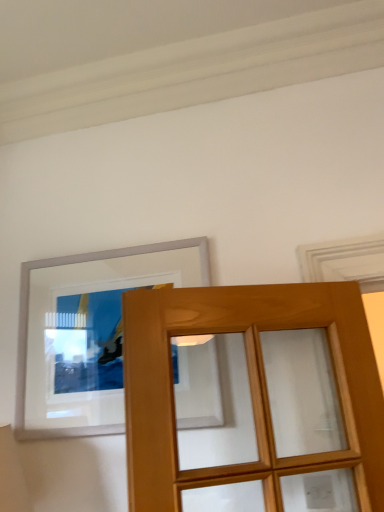
At what (x,y) coordinates should I click in order to perform the action: click on white glossy picture frame at upper left. Please return your answer as a coordinate pair (x, y). Looking at the image, I should click on (87, 333).

Describe the element at coordinates (87, 333) in the screenshot. I see `white glossy picture frame at upper left` at that location.

Measure the distance between point (165, 401) and camera.

The depth of point (165, 401) is 1.16 meters.

The height and width of the screenshot is (512, 384). Describe the element at coordinates (250, 386) in the screenshot. I see `light brown wood door at center` at that location.

What are the coordinates of `light brown wood door at center` in the screenshot? It's located at (250, 386).

Locate an element on the screen. white glossy picture frame at upper left is located at coordinates (87, 333).

Between white glossy picture frame at upper left and light brown wood door at center, which one appears on the left side from the viewer's perspective?

white glossy picture frame at upper left.

Is the position of white glossy picture frame at upper left less distant than that of light brown wood door at center?

No, white glossy picture frame at upper left is further to the viewer.

Does point (27, 368) come in front of point (265, 324)?

No, it is not.

From the image's perspective, is white glossy picture frame at upper left under light brown wood door at center?

No.

From a real-world perspective, does white glossy picture frame at upper left sit lower than light brown wood door at center?

No.

Does white glossy picture frame at upper left have a greater width compared to light brown wood door at center?

No, white glossy picture frame at upper left is not wider than light brown wood door at center.

Is white glossy picture frame at upper left taller than light brown wood door at center?

No, white glossy picture frame at upper left is not taller than light brown wood door at center.

Does white glossy picture frame at upper left have a smaller size compared to light brown wood door at center?

Correct, white glossy picture frame at upper left occupies less space than light brown wood door at center.

Can we say white glossy picture frame at upper left lies outside light brown wood door at center?

That's correct, white glossy picture frame at upper left is outside of light brown wood door at center.

Can you see white glossy picture frame at upper left touching light brown wood door at center?

No, white glossy picture frame at upper left is not beside light brown wood door at center.

Could you tell me if white glossy picture frame at upper left is facing light brown wood door at center?

No, white glossy picture frame at upper left is not oriented towards light brown wood door at center.

What's the angular difference between white glossy picture frame at upper left and light brown wood door at center's facing directions?

white glossy picture frame at upper left and light brown wood door at center are facing 25.1 degrees away from each other.

How far apart are white glossy picture frame at upper left and light brown wood door at center?

15.23 inches.

Locate an element on the screen. This screenshot has height=512, width=384. picture frame behind the light brown wood door at center is located at coordinates (87, 333).

Which object is positioned more to the right, light brown wood door at center or white glossy picture frame at upper left?

Positioned to the right is light brown wood door at center.

Which object is more forward, light brown wood door at center or white glossy picture frame at upper left?

light brown wood door at center is closer to the camera.

Considering the positions of point (348, 298) and point (25, 402), is point (348, 298) closer or farther from the camera than point (25, 402)?

Point (348, 298).

From the image's perspective, does light brown wood door at center appear higher than white glossy picture frame at upper left?

Incorrect, from the image's perspective, light brown wood door at center is lower than white glossy picture frame at upper left.

From a real-world perspective, is light brown wood door at center positioned above or below white glossy picture frame at upper left?

Clearly, from a real-world perspective, light brown wood door at center is below white glossy picture frame at upper left.

Which object is thinner, light brown wood door at center or white glossy picture frame at upper left?

With smaller width is white glossy picture frame at upper left.

Is light brown wood door at center taller or shorter than white glossy picture frame at upper left?

In the image, light brown wood door at center appears to be taller than white glossy picture frame at upper left.

In terms of size, does light brown wood door at center appear bigger or smaller than white glossy picture frame at upper left?

In the image, light brown wood door at center appears to be larger than white glossy picture frame at upper left.

Is light brown wood door at center spatially inside white glossy picture frame at upper left, or outside of it?

light brown wood door at center is spatially situated outside white glossy picture frame at upper left.

Is light brown wood door at center not close to white glossy picture frame at upper left?

No, there isn't a large distance between light brown wood door at center and white glossy picture frame at upper left.

Is light brown wood door at center turned away from white glossy picture frame at upper left?

Absolutely, light brown wood door at center is directed away from white glossy picture frame at upper left.

What are the coordinates of `door to the right of white glossy picture frame at upper left` in the screenshot? It's located at (250, 386).

Where is `picture frame above the light brown wood door at center (from the image's perspective)`? picture frame above the light brown wood door at center (from the image's perspective) is located at coordinates (87, 333).

In the image, there is a white glossy picture frame at upper left. At what (x,y) coordinates should I click in order to perform the action: click on door below it (from a real-world perspective). Please return your answer as a coordinate pair (x, y). Looking at the image, I should click on pos(250,386).